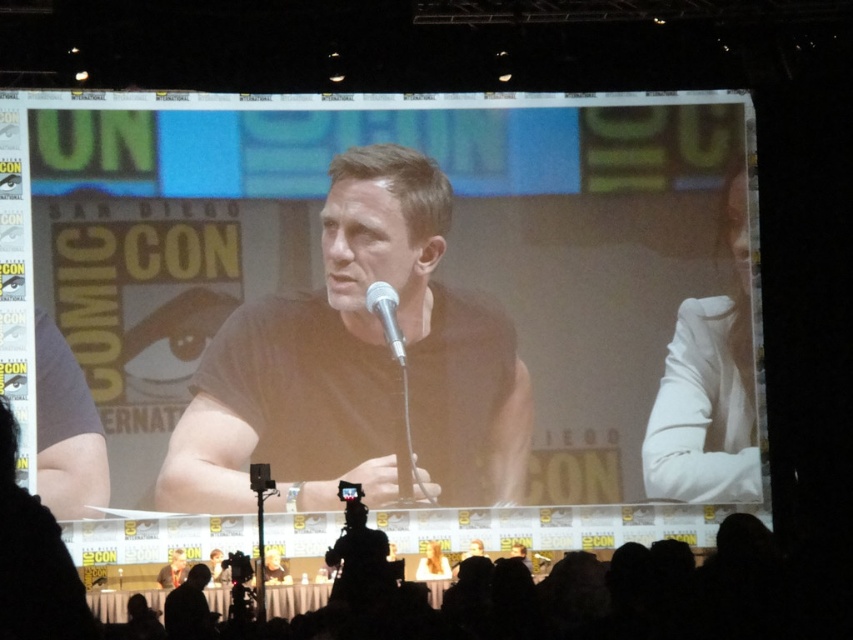
Question: Which of the following is the farthest from the observer?

Choices:
 (A) black matte shirt at center
 (B) silver metallic microphone at center
 (C) matte black shirt at center
 (D) white fabric at right

Answer: (D)

Question: Is black matte shirt at center smaller than white fabric at right?

Choices:
 (A) yes
 (B) no

Answer: (B)

Question: Which object appears farthest from the camera in this image?

Choices:
 (A) black matte shirt at center
 (B) silver metallic microphone at center

Answer: (B)

Question: Is white fabric at right in front of silver metallic microphone at center?

Choices:
 (A) no
 (B) yes

Answer: (A)

Question: Estimate the real-world distances between objects in this image. Which object is farther from the silver metallic microphone at center?

Choices:
 (A) black matte shirt at center
 (B) white fabric at right
 (C) silhouette crowd at lower center

Answer: (B)

Question: Is white fabric at right above silver metallic microphone at center?

Choices:
 (A) yes
 (B) no

Answer: (B)